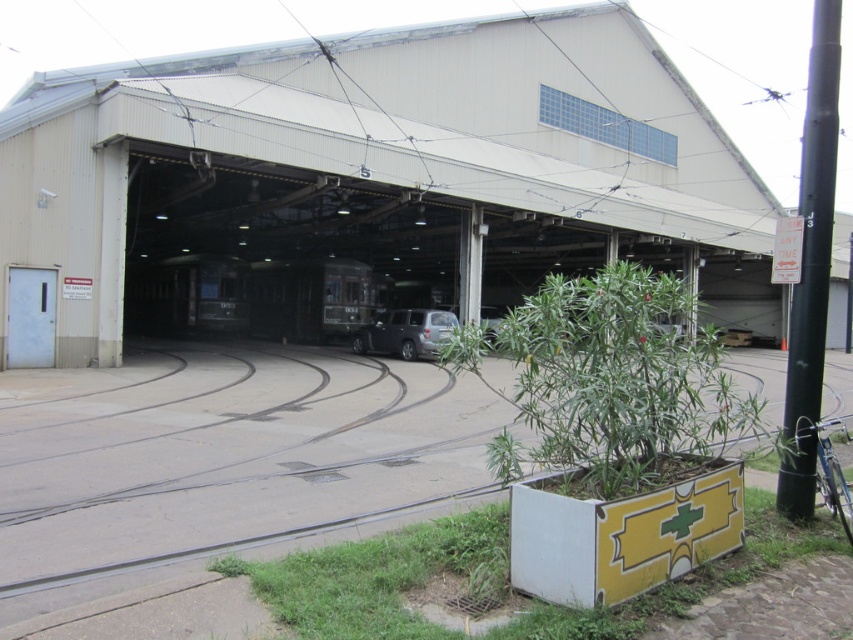
You are a driver approaching the satin black suv at center in the industrial facility. There is a black metal pole at right nearby. To avoid hitting the pole, which direction should you turn your vehicle?

The black metal pole at right is to the right of the satin black suv at center, so you should turn left to avoid hitting the pole.

You are a delivery driver who needs to park your truck, which is 2 meters wide, in this facility. There is a black metal pole at right and a satin black suv at center. Which vehicle or object has a width that could potentially block your truck from parking?

The black metal pole at right has a larger width than the satin black suv at center. Since the pole is wider, it might block the truck more than the SUV. However, without knowing the exact width of the pole, it is uncertain if it specifically blocks the truck. The SUV is narrower, so it is less likely to block the truck.

You are standing outside the industrial building and want to enter the nearest entrance. The entrance is located between the black metal pole at right and the satin black suv at center. Which object should you approach first to reach the entrance?

The entrance is between the black metal pole at right and the satin black suv at center. Since the black metal pole at right is closer to the viewer, you should approach it first to reach the entrance.